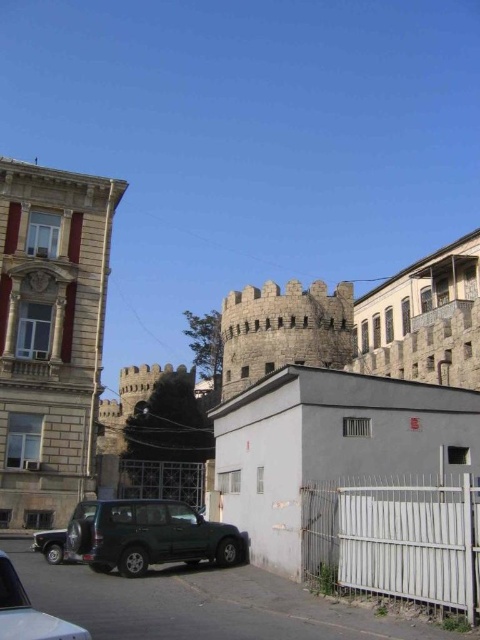
You are a delivery driver needing to park your dark green matte suv at center in a parking spot that requires a minimum width of 2 meters. Can the white metal fence at lower right block your parking if it is only 1.5 meters wide?

The white metal fence at lower right has a lesser width compared to dark green matte suv at center. Since the parking spot requires a minimum width of 2 meters and the fence is only 1.5 meters wide, the fence itself won not block the parking. However, the suv must still fit within the 2 meter width requirement. If the suv is wider than 2 meters, it won not fit regardless of the fence.

You are a delivery driver approaching the smooth stone tower at left and the dark green matte suv at center. Your truck is 20 meters long. Can you safely navigate between them without hitting either?

The smooth stone tower at left is 19.91 meters away from the dark green matte suv at center. Since your truck is 20 meters long, it would not fit between them as the distance is slightly less than the truck length. You need to choose another path.